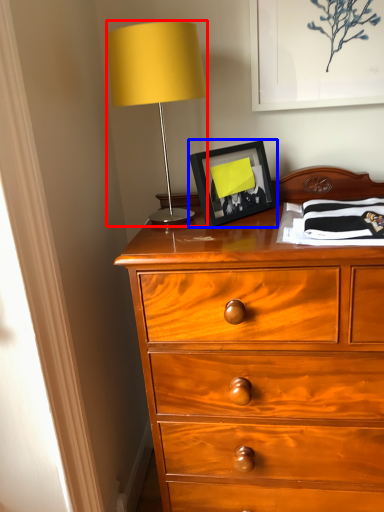
Question: Which object is further to the camera taking this photo, table lamp (highlighted by a red box) or picture frame (highlighted by a blue box)?

Choices:
 (A) table lamp
 (B) picture frame

Answer: (B)